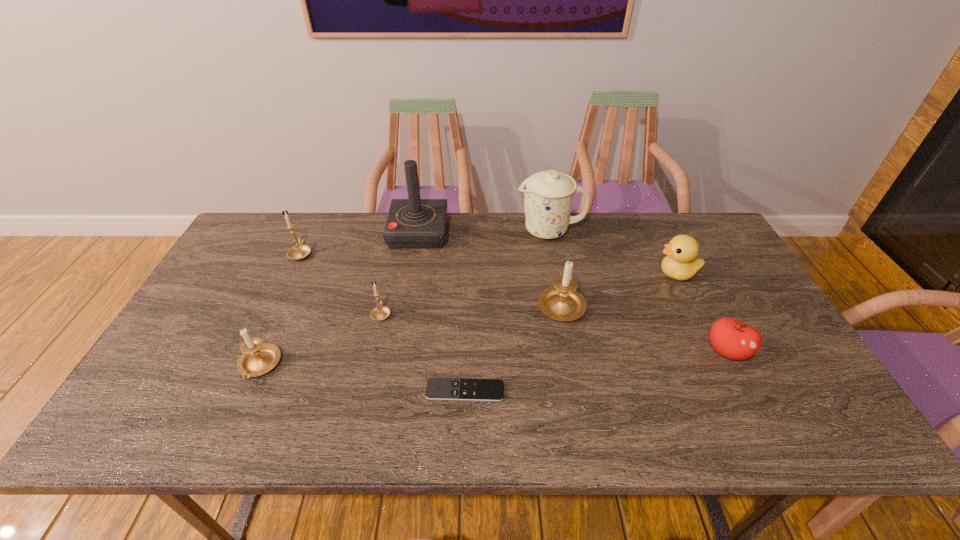
I want to click on joystick, so click(413, 223).

You are a GUI agent. You are given a task and a screenshot of the screen. Output one action in this format:
    pyautogui.click(x=<x>, y=<y>)
    Task: Click on the eighth shortest object
    The image size is (960, 540).
    Given the screenshot: What is the action you would take?
    (548, 195)

You are a GUI agent. You are given a task and a screenshot of the screen. Output one action in this format:
    pyautogui.click(x=<x>, y=<y>)
    Task: Click on the farther gold candle holder
    
    Given the screenshot: What is the action you would take?
    pyautogui.click(x=298, y=252)

Locate an element on the screen. Image resolution: width=960 pixels, height=540 pixels. the bigger gold candle holder is located at coordinates (298, 252).

Identify the location of the bigger beige candle holder. This screenshot has height=540, width=960. point(562,302).

At what (x,y) coordinates should I click in order to perform the action: click on the right beige candle holder. Please return your answer as a coordinate pair (x, y). This screenshot has height=540, width=960. Looking at the image, I should click on (562, 302).

I want to click on duck, so click(680, 263).

You are a GUI agent. You are given a task and a screenshot of the screen. Output one action in this format:
    pyautogui.click(x=<x>, y=<y>)
    Task: Click on the second candle holder from right to left
    This screenshot has height=540, width=960.
    Given the screenshot: What is the action you would take?
    pyautogui.click(x=381, y=312)

You are a GUI agent. You are given a task and a screenshot of the screen. Output one action in this format:
    pyautogui.click(x=<x>, y=<y>)
    Task: Click on the nearer gold candle holder
    Image resolution: width=960 pixels, height=540 pixels.
    Given the screenshot: What is the action you would take?
    pyautogui.click(x=381, y=312)

Identify the location of the smaller beige candle holder. click(258, 358).